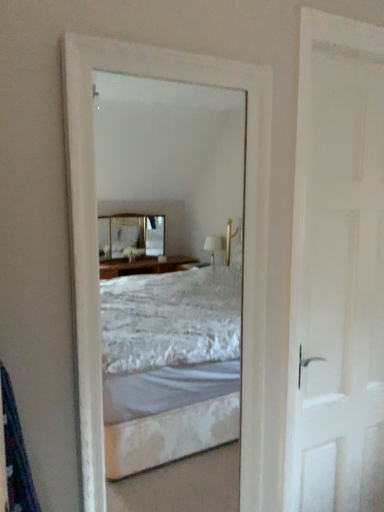
This screenshot has height=512, width=384. Describe the element at coordinates (337, 285) in the screenshot. I see `white wooden door at right` at that location.

Identify the location of white wooden door at right. (337, 285).

The image size is (384, 512). In order to click on white wooden door at right in this screenshot , I will do `click(337, 285)`.